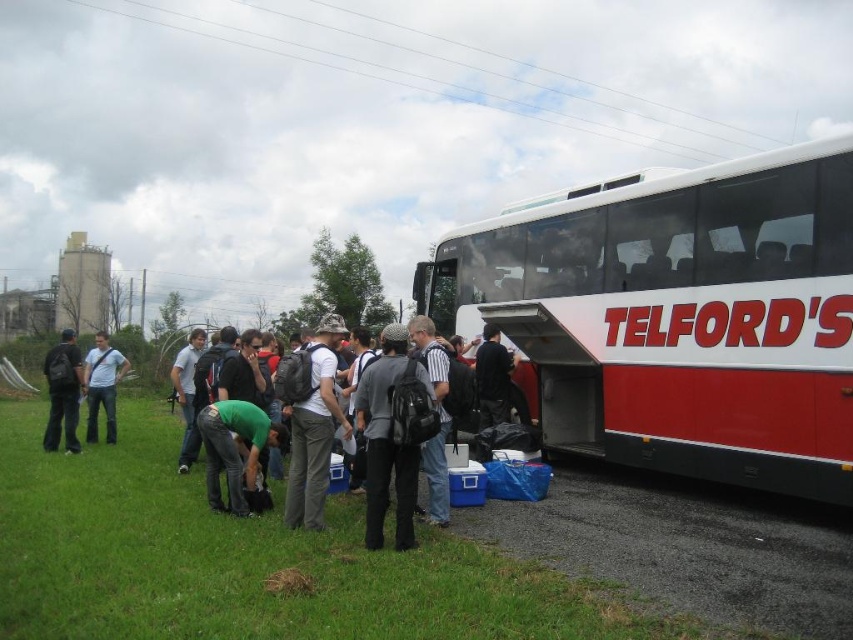
You are a traveler who just arrived at the scene. You see a matte black backpack at left and a black backpack at center. Which backpack is positioned closer to the left side of the scene?

The matte black backpack at left is positioned closer to the left side of the scene than the black backpack at center.

You are standing at the origin point of the coordinate system in this scene. The red matte bus at right is located at a specific coordinate. Can you determine if the bus is positioned closer to the right edge of the image compared to its y coordinate?

The red matte bus at right is located at coordinate point (677, 316). Since the x coordinate 0.494 is less than 0.5, it means the bus is positioned closer to the left side of the image rather than the right edge. Therefore, the bus is not closer to the right edge in terms of its x coordinate.

You are a photographer trying to capture a wide shot of the scene. The red matte bus at right and the matte black backpack at left are both in your frame. Since you want to emphasize the backpack, should you adjust your camera to focus on the backpack first, considering their sizes?

The red matte bus at right is thinner than the matte black backpack at left, so the backpack appears larger. To emphasize the backpack, focus on it first as it is bigger in the frame.